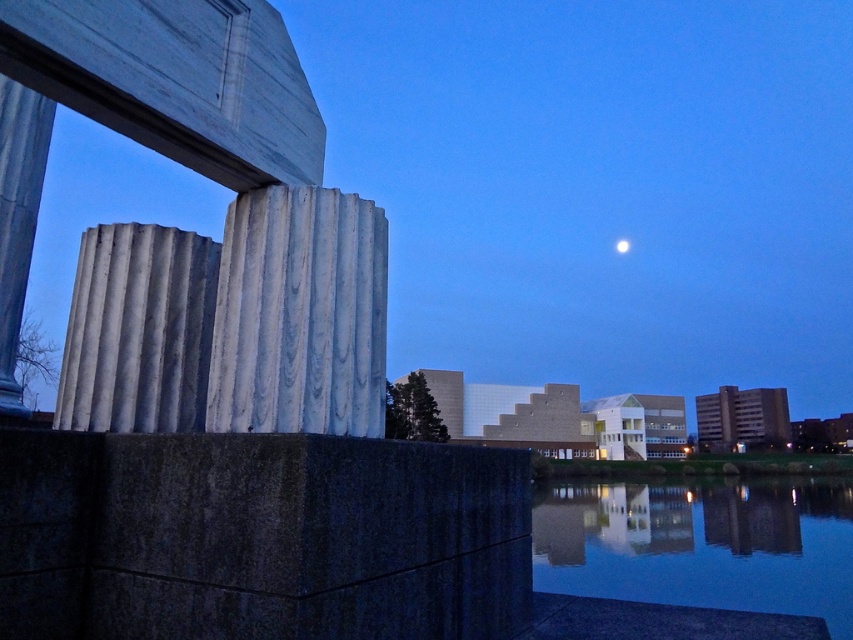
You are a photographer planning to capture the white glossy moon at upper center and the smooth reflective water at center in one frame. Based on their sizes in the image, which object would require a wider shot to include fully?

The smooth reflective water at center might be wider than white glossy moon at upper center, so it would require a wider shot to include fully.

You are an architect designing a new sculpture that needs to be placed in the foreground. The sculpture must be taller than the white glossy moon at upper center but shorter than the smooth reflective water at center. Is this possible? Please explain using the given information.

The smooth reflective water at center is taller than the white glossy moon at upper center. Therefore, the sculpture must be placed between their heights to satisfy both conditions. Since the water is taller than the moon, there is a range where the sculpture can be taller than the moon but shorter than the water. Thus, it is possible.

You are standing in the urban scene and want to place a small statue exactly halfway between point (305, 337) and point (625, 488). Will the statue be closer to the reflective water or the modern buildings?

The statue placed halfway between point (305, 337) and point (625, 488) will be closer to the reflective water because point (305, 337) is closer to the viewer than point (625, 488), so the midpoint leans towards the viewer.